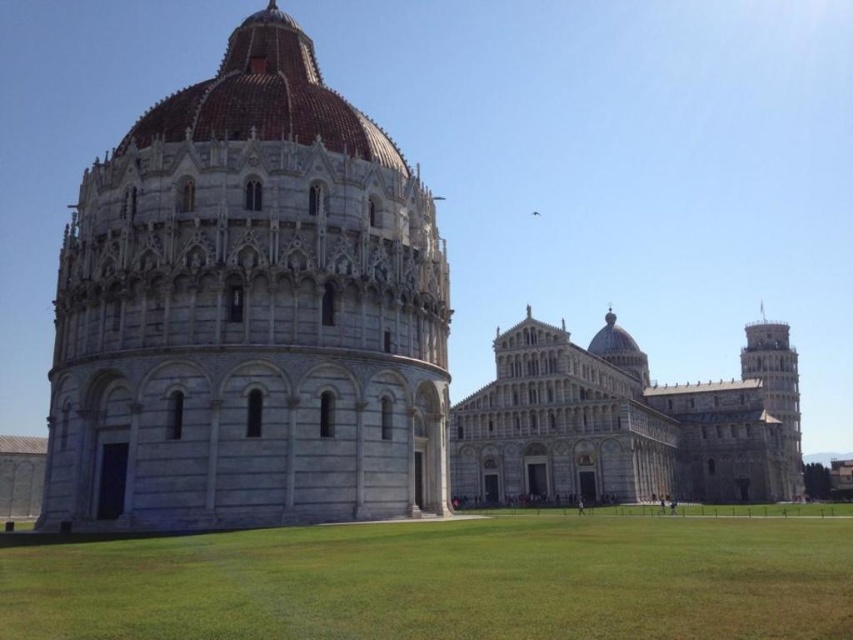
Question: Which object is farther from the camera taking this photo?

Choices:
 (A) green grass at lower center
 (B) gray stone leaning tower at right
 (C) white marble tower at center
 (D) brown tiled dome at upper center

Answer: (B)

Question: From the image, what is the correct spatial relationship of white marble tower at center in relation to green grass at lower center?

Choices:
 (A) right
 (B) left

Answer: (B)

Question: Estimate the real-world distances between objects in this image. Which object is farther from the gray stone leaning tower at right?

Choices:
 (A) green grass at lower center
 (B) brown tiled dome at upper center

Answer: (B)

Question: Can you confirm if green grass at lower center is positioned below brown tiled dome at upper center?

Choices:
 (A) no
 (B) yes

Answer: (B)

Question: Can you confirm if white marble tower at center is positioned below gray stone leaning tower at right?

Choices:
 (A) yes
 (B) no

Answer: (B)

Question: Estimate the real-world distances between objects in this image. Which object is closer to the white marble tower at center?

Choices:
 (A) green grass at lower center
 (B) gray stone leaning tower at right

Answer: (A)